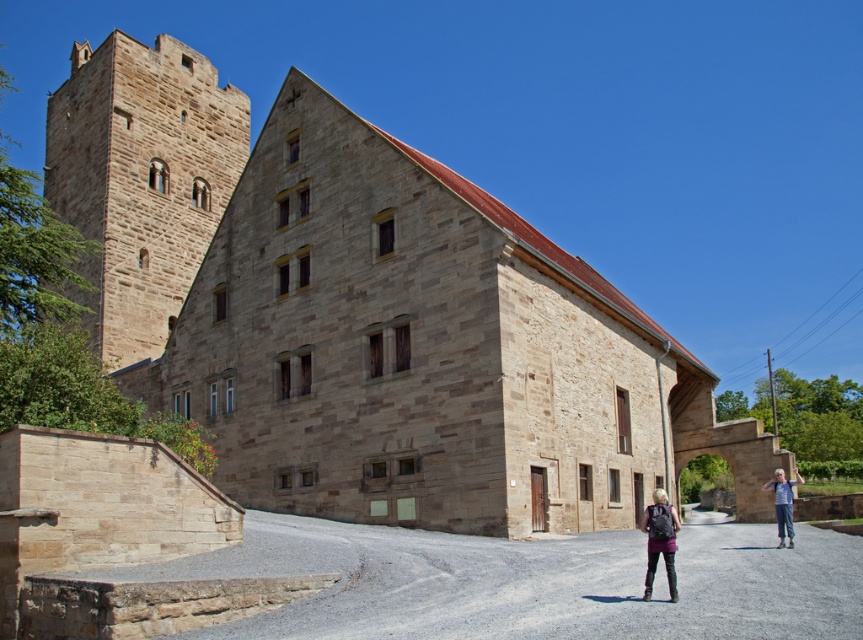
Question: Which of the following is the closest to the observer?

Choices:
 (A) brown stone tower at upper left
 (B) matte purple jacket at lower center

Answer: (B)

Question: Which point is farther to the camera?

Choices:
 (A) (104, 116)
 (B) (662, 522)
 (C) (795, 474)

Answer: (A)

Question: Among these objects, which one is farthest from the camera?

Choices:
 (A) brown stone tower at upper left
 (B) denim pants at lower right
 (C) matte purple jacket at lower center

Answer: (A)

Question: Can you confirm if brown stone tower at upper left is positioned to the right of denim pants at lower right?

Choices:
 (A) no
 (B) yes

Answer: (A)

Question: Where is brown stone tower at upper left located in relation to matte purple jacket at lower center in the image?

Choices:
 (A) left
 (B) right

Answer: (A)

Question: Considering the relative positions of brown stone tower at upper left and denim pants at lower right in the image provided, where is brown stone tower at upper left located with respect to denim pants at lower right?

Choices:
 (A) below
 (B) above

Answer: (B)